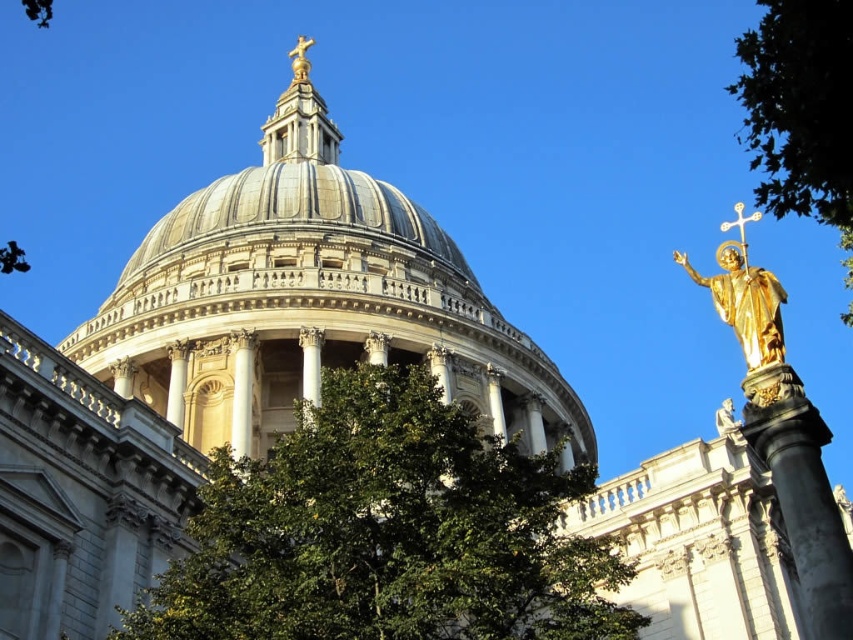
Question: Can you confirm if green leafy tree at right is positioned to the right of gold metallic statue at right?

Choices:
 (A) no
 (B) yes

Answer: (B)

Question: Which point is farther to the camera?

Choices:
 (A) metallic gold cross at upper right
 (B) gold metallic statue at top
 (C) dark gray stone column at right
 (D) gold metallic statue at right

Answer: (B)

Question: Is matte gray dome at center bigger than green leafy tree at right?

Choices:
 (A) yes
 (B) no

Answer: (B)

Question: Which point is farther to the camera?

Choices:
 (A) (790, 179)
 (B) (845, 564)
 (C) (473, 376)

Answer: (C)

Question: Which point is farther to the camera?

Choices:
 (A) dark gray stone column at right
 (B) gold polished statue at right

Answer: (B)

Question: Does green leafy tree at center appear over green leafy tree at right?

Choices:
 (A) no
 (B) yes

Answer: (A)